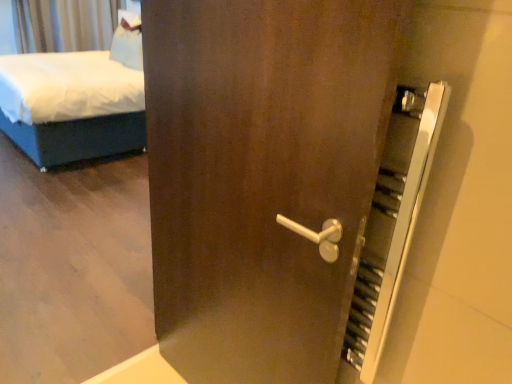
Question: Considering the relative positions of silky gray curtain at upper left and white fabric bed at left in the image provided, is silky gray curtain at upper left to the left or to the right of white fabric bed at left?

Choices:
 (A) left
 (B) right

Answer: (A)

Question: In terms of height, does silky gray curtain at upper left look taller or shorter compared to white fabric bed at left?

Choices:
 (A) tall
 (B) short

Answer: (B)

Question: Is point (25, 13) positioned closer to the camera than point (9, 105)?

Choices:
 (A) closer
 (B) farther

Answer: (B)

Question: Do you think white fabric bed at left is within silky gray curtain at upper left, or outside of it?

Choices:
 (A) outside
 (B) inside

Answer: (A)

Question: Considering their positions, is white fabric bed at left located in front of or behind silky gray curtain at upper left?

Choices:
 (A) behind
 (B) front

Answer: (B)

Question: Looking at their shapes, would you say white fabric bed at left is wider or thinner than silky gray curtain at upper left?

Choices:
 (A) thin
 (B) wide

Answer: (B)

Question: From a real-world perspective, is white fabric bed at left positioned above or below silky gray curtain at upper left?

Choices:
 (A) below
 (B) above

Answer: (A)